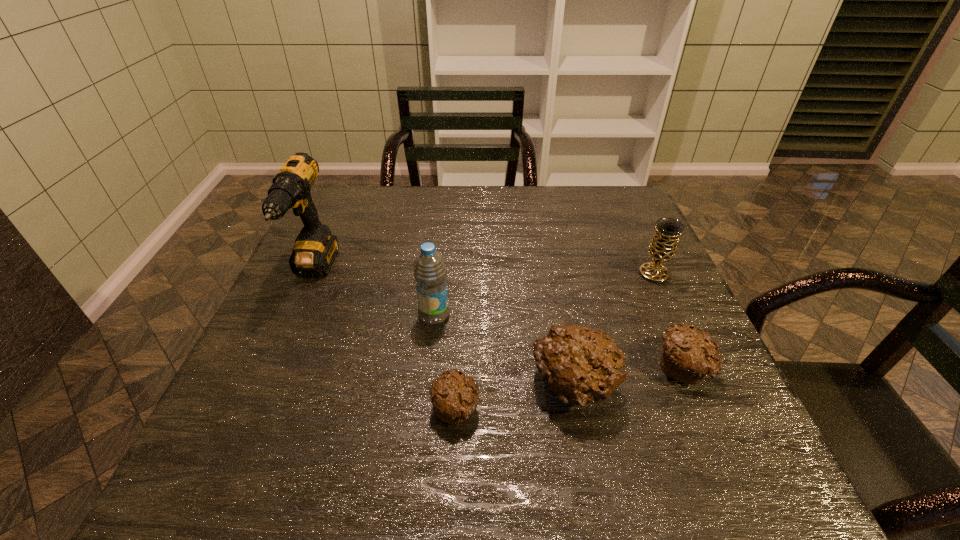
In order to click on empty space between the second muffin from right to left and the water bottle in this screenshot , I will do `click(504, 351)`.

In order to click on free space between the third shortest object and the second tallest object in this screenshot , I will do `click(504, 351)`.

This screenshot has height=540, width=960. What are the coordinates of `unoccupied position between the second muffin from left to right and the tallest object` in the screenshot? It's located at (444, 329).

Identify the location of object that is the fifth closest one to the tallest object. (662, 248).

Locate an element on the screen. This screenshot has height=540, width=960. object that is the fourth closest one to the third shortest object is located at coordinates (662, 248).

Identify the location of muffin that is the second closest to the fourth shortest object. This screenshot has width=960, height=540. (580, 365).

Locate an element on the screen. The height and width of the screenshot is (540, 960). muffin identified as the closest to the fourth tallest object is located at coordinates (688, 355).

You are a GUI agent. You are given a task and a screenshot of the screen. Output one action in this format:
    pyautogui.click(x=<x>, y=<y>)
    Task: Click on the free region that satisfies the following two spatial constraints: 1. at the tip of the rightmost muffin; 2. on the right side of the tallest object
    Image resolution: width=960 pixels, height=540 pixels.
    Given the screenshot: What is the action you would take?
    pyautogui.click(x=272, y=367)

This screenshot has width=960, height=540. What are the coordinates of `vacant space that satisfies the following two spatial constraints: 1. on the back side of the second tallest muffin; 2. on the right side of the third tallest object` in the screenshot? It's located at (644, 274).

Locate an element on the screen. This screenshot has width=960, height=540. free space in the image that satisfies the following two spatial constraints: 1. at the tip of the chalice; 2. on the left side of the drill is located at coordinates (313, 274).